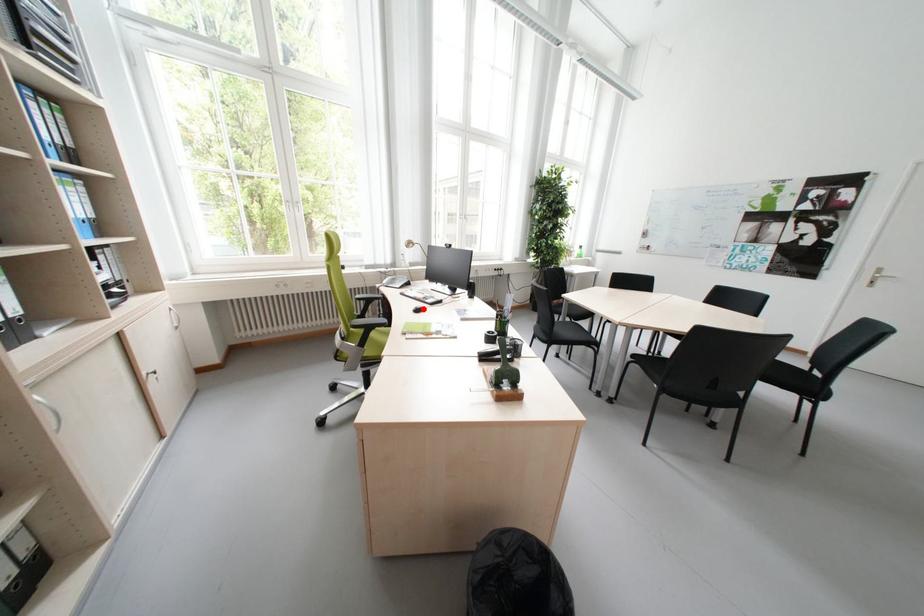
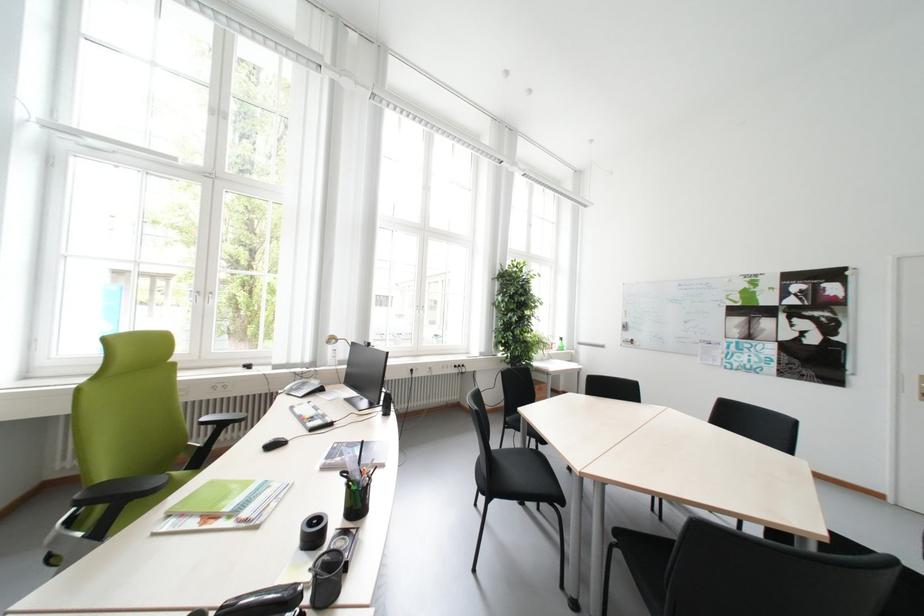
Find the pixel in the second image that matches the highlighted location in the first image.

(277, 442)